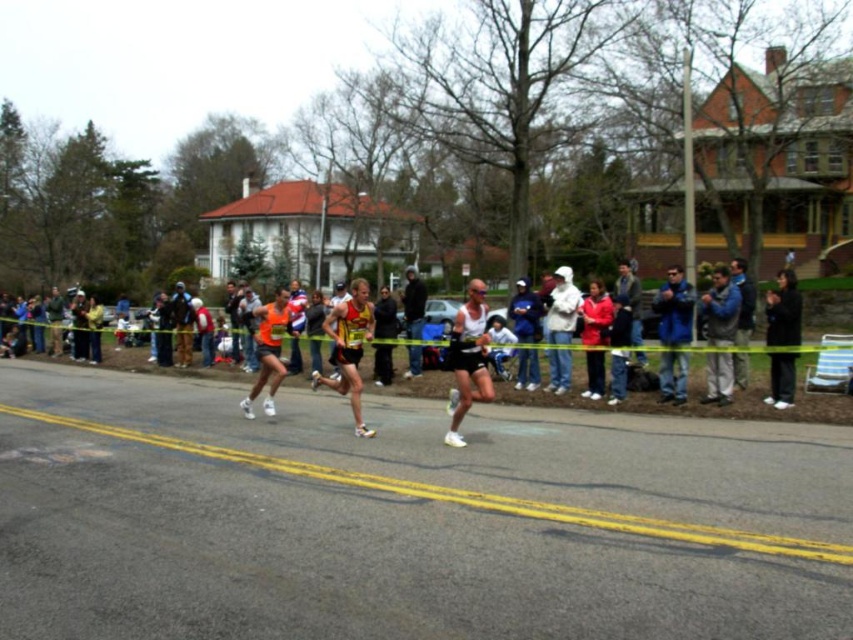
Question: Can you confirm if white matte tank top at center is positioned to the right of blue fleece jacket at right?

Choices:
 (A) no
 (B) yes

Answer: (A)

Question: Can you confirm if blue fabric jacket at center is positioned to the right of black fabric jacket at right?

Choices:
 (A) yes
 (B) no

Answer: (B)

Question: Which of the following is the farthest from the observer?

Choices:
 (A) (350, 483)
 (B) (598, 364)
 (C) (775, 301)

Answer: (B)

Question: Can you confirm if jeans at center is positioned below yellow asphalt at center?

Choices:
 (A) no
 (B) yes

Answer: (A)

Question: Among these points, which one is farthest from the camera?

Choices:
 (A) (792, 403)
 (B) (718, 353)
 (C) (558, 284)
 (D) (589, 372)

Answer: (C)

Question: Which point appears closest to the camera in this image?

Choices:
 (A) (248, 396)
 (B) (451, 371)
 (C) (548, 312)
 (D) (772, 384)

Answer: (D)